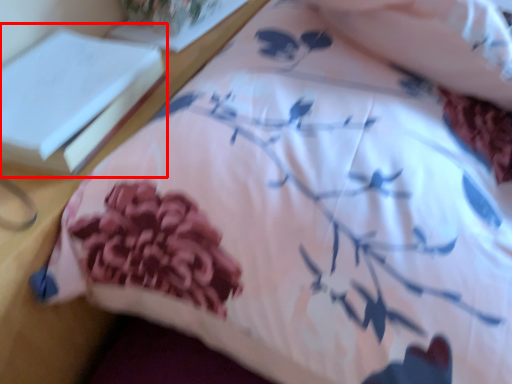
Question: From the image's perspective, where is book (annotated by the red box) located relative to book?

Choices:
 (A) below
 (B) above

Answer: (A)